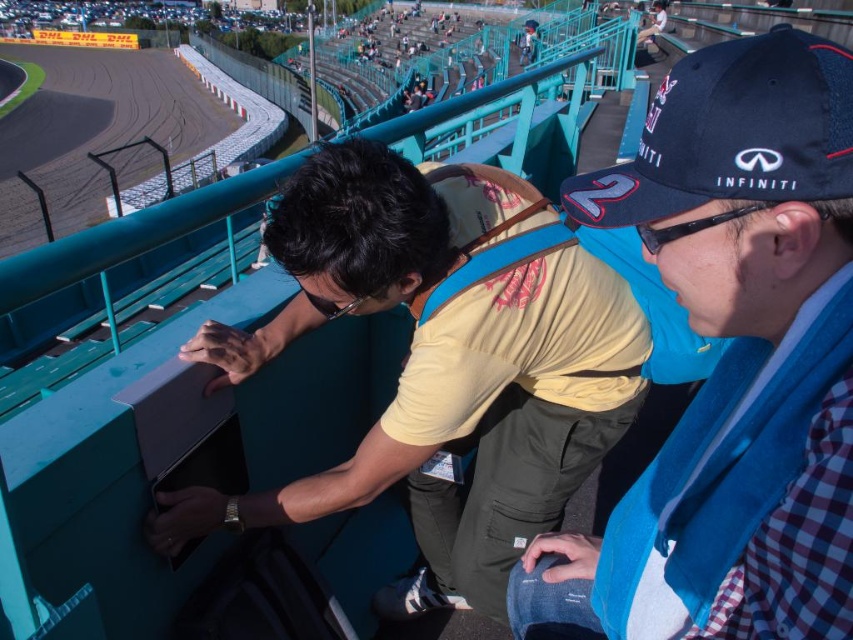
Who is positioned more to the left, blue fabric scarf at center-right or navy blue mesh baseball cap at upper right?

From the viewer's perspective, navy blue mesh baseball cap at upper right appears more on the left side.

Does blue fabric scarf at center-right have a greater width compared to navy blue mesh baseball cap at upper right?

Yes.

Between point (756, 100) and point (810, 77), which one is positioned in front?

Point (810, 77) is more forward.

Find the location of a particular element. The width and height of the screenshot is (853, 640). blue fabric scarf at center-right is located at coordinates (730, 362).